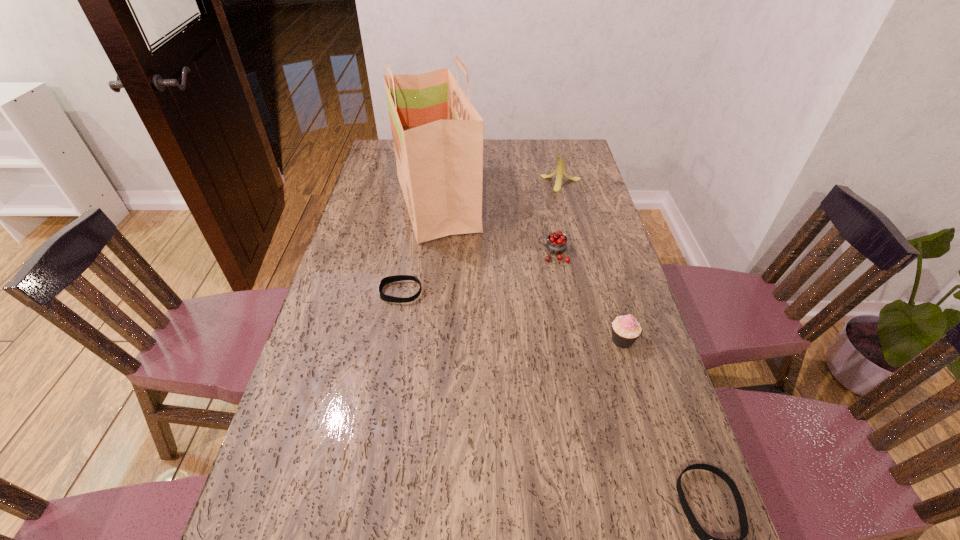
Locate an element on the screen. vacant point located 0.290m on the handle side of the cherry is located at coordinates (448, 253).

Where is `free space located 0.300m on the handle side of the cherry`? The image size is (960, 540). free space located 0.300m on the handle side of the cherry is located at coordinates (445, 253).

Where is `vacant space situated 0.230m on the front of the grocery bag`? The image size is (960, 540). vacant space situated 0.230m on the front of the grocery bag is located at coordinates (425, 296).

Where is `free space located on the front of the banana`? The height and width of the screenshot is (540, 960). free space located on the front of the banana is located at coordinates (574, 232).

Identify the location of vacant space situated 0.090m on the left of the fifth farthest object. The height and width of the screenshot is (540, 960). (574, 340).

Find the location of a particular element. wristband located in the left edge section of the desktop is located at coordinates (390, 279).

At what (x,y) coordinates should I click in order to perform the action: click on grocery bag that is at the left edge. Please return your answer as a coordinate pair (x, y). The image size is (960, 540). Looking at the image, I should click on (437, 134).

This screenshot has height=540, width=960. What are the coordinates of `cherry at the right edge` in the screenshot? It's located at (556, 244).

Find the location of a particular element. banana that is positioned at the right edge is located at coordinates click(560, 170).

Where is `cupcake present at the right edge`? Image resolution: width=960 pixels, height=540 pixels. cupcake present at the right edge is located at coordinates (626, 330).